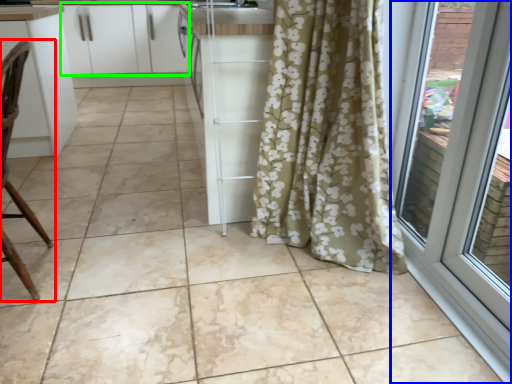
Question: Which object is positioned closest to chair (highlighted by a red box)? Select from door (highlighted by a blue box) and cabinetry (highlighted by a green box).

Choices:
 (A) door
 (B) cabinetry

Answer: (A)